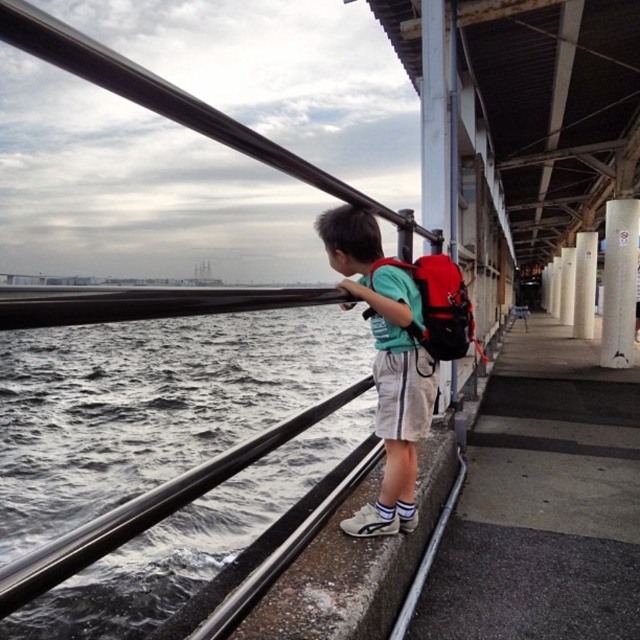
You are standing on the waterfront promenade and want to place a small potted plant between the gray matte water at left and the green fabric backpack at center. Can you determine which object is lower so you know where to place the plant?

The gray matte water at left is located below the green fabric backpack at center, so you should place the plant near the gray matte water at left since it is lower.

You are a photographer trying to capture the entire waterfront scene in one shot. Given that the gray matte water at left and the green fabric backpack at center are both in your frame, which object should you focus on to ensure both are clearly visible?

Since the gray matte water at left is larger in size than the green fabric backpack at center, you should focus on the gray matte water at left to ensure both objects are clearly visible in the frame.